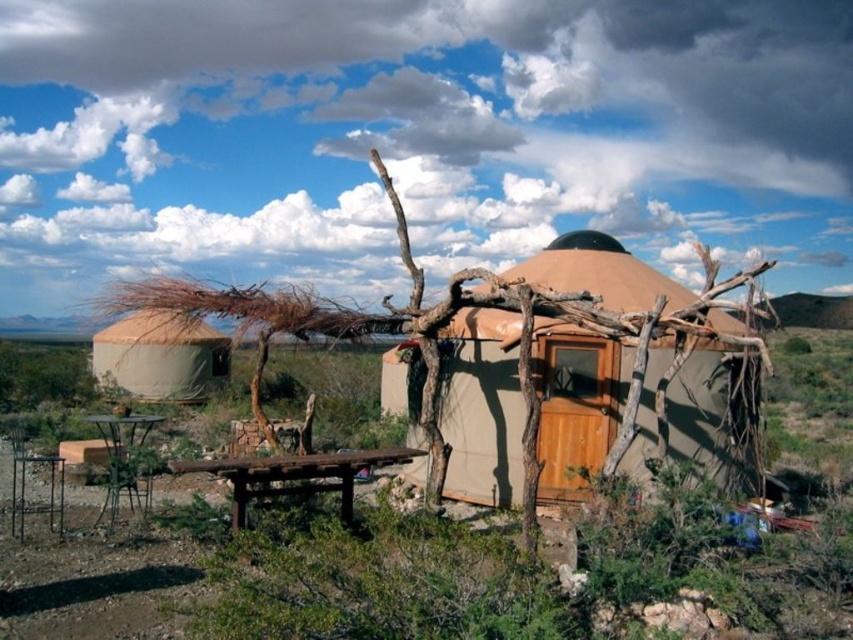
Can you confirm if beige canvas yurt at center is positioned to the right of rusty wood picnic table at lower center?

Indeed, beige canvas yurt at center is positioned on the right side of rusty wood picnic table at lower center.

Does beige canvas yurt at center have a lesser height compared to rusty wood picnic table at lower center?

No.

Image resolution: width=853 pixels, height=640 pixels. Identify the location of beige canvas yurt at center. (482, 406).

I want to click on beige canvas yurt at center, so click(x=482, y=406).

Is point (322, 486) less distant than point (129, 413)?

That is True.

How distant is rusty wood picnic table at lower center from metallic brown picnic table at lower left?

The distance of rusty wood picnic table at lower center from metallic brown picnic table at lower left is 2.93 meters.

Is point (312, 481) positioned in front of point (132, 492)?

Yes, point (312, 481) is in front of point (132, 492).

Find the location of `rusty wood picnic table at lower center`. rusty wood picnic table at lower center is located at coordinates (296, 476).

Is point (146, 346) positioned after point (157, 417)?

That is True.

Is beige canvas yurt at left wider than metallic brown picnic table at lower left?

Indeed, beige canvas yurt at left has a greater width compared to metallic brown picnic table at lower left.

Locate an element on the screen. This screenshot has width=853, height=640. beige canvas yurt at left is located at coordinates (160, 356).